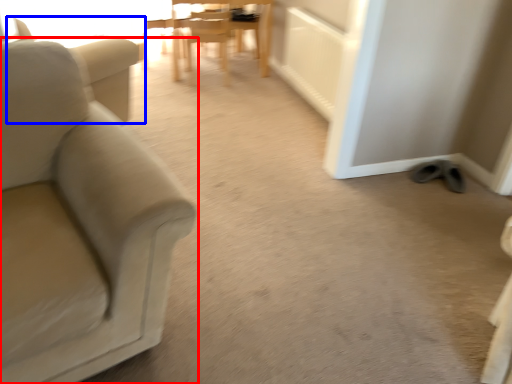
Question: Which object is further to the camera taking this photo, chair (highlighted by a red box) or swivel chair (highlighted by a blue box)?

Choices:
 (A) chair
 (B) swivel chair

Answer: (B)